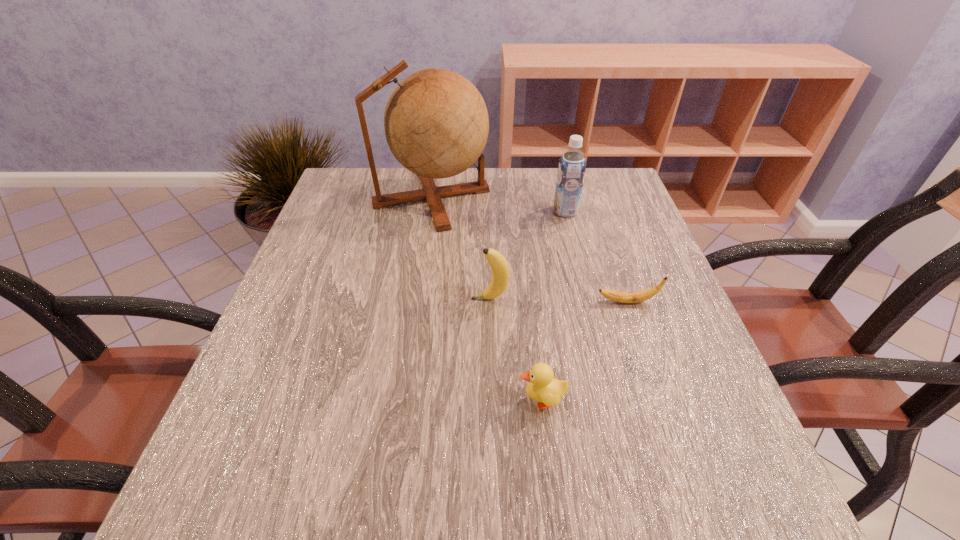
The width and height of the screenshot is (960, 540). In order to click on vacant space at the left edge of the desktop in this screenshot , I will do `click(300, 330)`.

Identify the location of vacant area at the right edge. This screenshot has width=960, height=540. (623, 272).

Where is `vacant area at the far left corner`? Image resolution: width=960 pixels, height=540 pixels. vacant area at the far left corner is located at coordinates (392, 173).

Locate an element on the screen. The height and width of the screenshot is (540, 960). vacant space at the far right corner is located at coordinates (607, 189).

Where is `vacant space that's between the taller banana and the soya milk`? Image resolution: width=960 pixels, height=540 pixels. vacant space that's between the taller banana and the soya milk is located at coordinates (527, 255).

Locate an element on the screen. The width and height of the screenshot is (960, 540). vacant space that is in between the nearest object and the shortest object is located at coordinates (585, 351).

Identify the location of free spot between the nearest object and the second tallest object. (553, 306).

The width and height of the screenshot is (960, 540). What are the coordinates of `unoccupied position between the third shortest object and the globe` in the screenshot? It's located at (461, 248).

Identify the location of free space between the globe and the taller banana. (461, 248).

What are the coordinates of `empty space that is in between the globe and the taller banana` in the screenshot? It's located at click(461, 248).